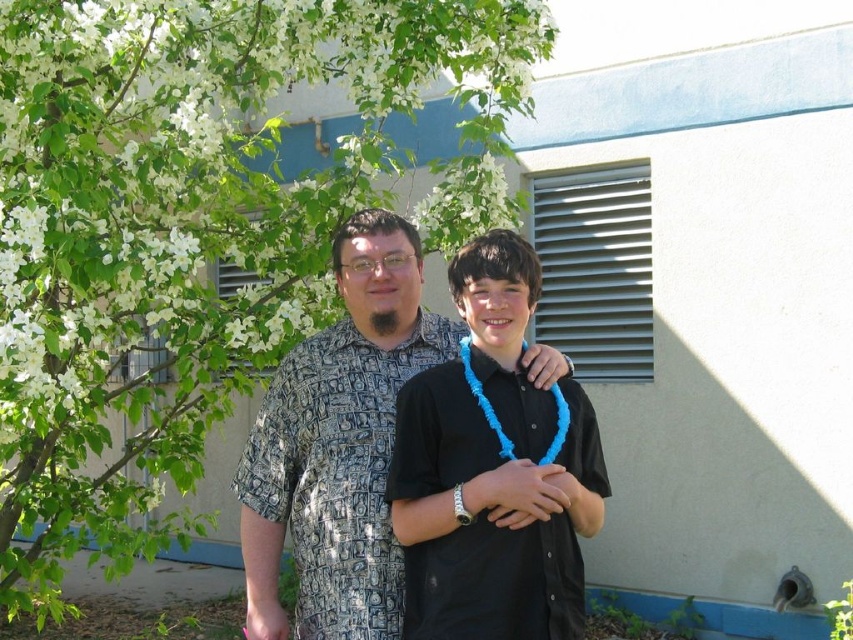
Between black matte shirt at center and patterned fabric shirt at center, which one has less height?

A: With less height is black matte shirt at center.

Between black matte shirt at center and patterned fabric shirt at center, which one appears on the left side from the viewer's perspective?

patterned fabric shirt at center is more to the left.

Locate an element on the screen. This screenshot has height=640, width=853. black matte shirt at center is located at coordinates (492, 472).

Is green leafy tree at upper left below patterned fabric shirt at center?

Incorrect, green leafy tree at upper left is not positioned below patterned fabric shirt at center.

Is green leafy tree at upper left bigger than patterned fabric shirt at center?

Yes, green leafy tree at upper left is bigger than patterned fabric shirt at center.

What do you see at coordinates (194, 227) in the screenshot?
I see `green leafy tree at upper left` at bounding box center [194, 227].

The height and width of the screenshot is (640, 853). Find the location of `green leafy tree at upper left`. green leafy tree at upper left is located at coordinates (194, 227).

Can you confirm if green leafy tree at upper left is smaller than black matte shirt at center?

Actually, green leafy tree at upper left might be larger than black matte shirt at center.

Is point (466, 32) less distant than point (526, 269)?

No.

Find the location of a particular element. green leafy tree at upper left is located at coordinates (194, 227).